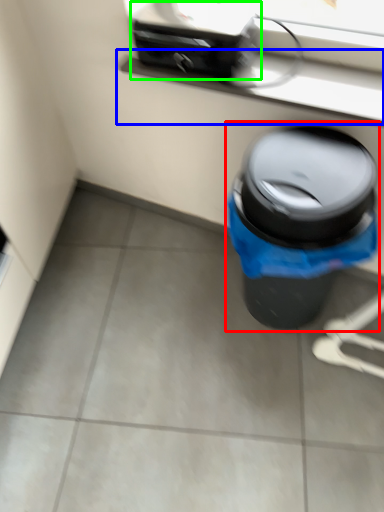
Question: Estimate the real-world distances between objects in this image. Which object is closer to waste container (highlighted by a red box), window sill (highlighted by a blue box) or appliance (highlighted by a green box)?

Choices:
 (A) window sill
 (B) appliance

Answer: (A)